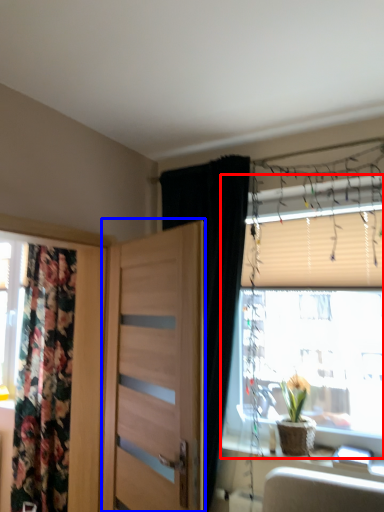
Question: Which object is closer to the camera taking this photo, window (highlighted by a red box) or door (highlighted by a blue box)?

Choices:
 (A) window
 (B) door

Answer: (B)